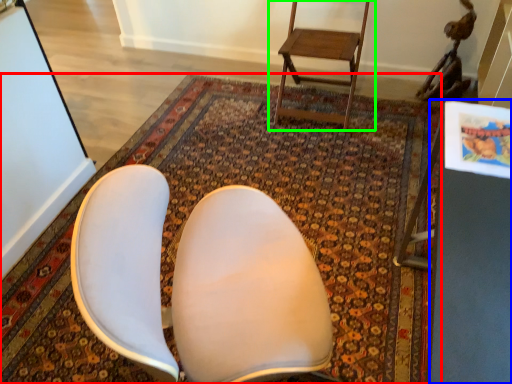
Question: Estimate the real-world distances between objects in this image. Which object is closer to mat (highlighted by a red box), table (highlighted by a blue box) or chair (highlighted by a green box)?

Choices:
 (A) table
 (B) chair

Answer: (B)